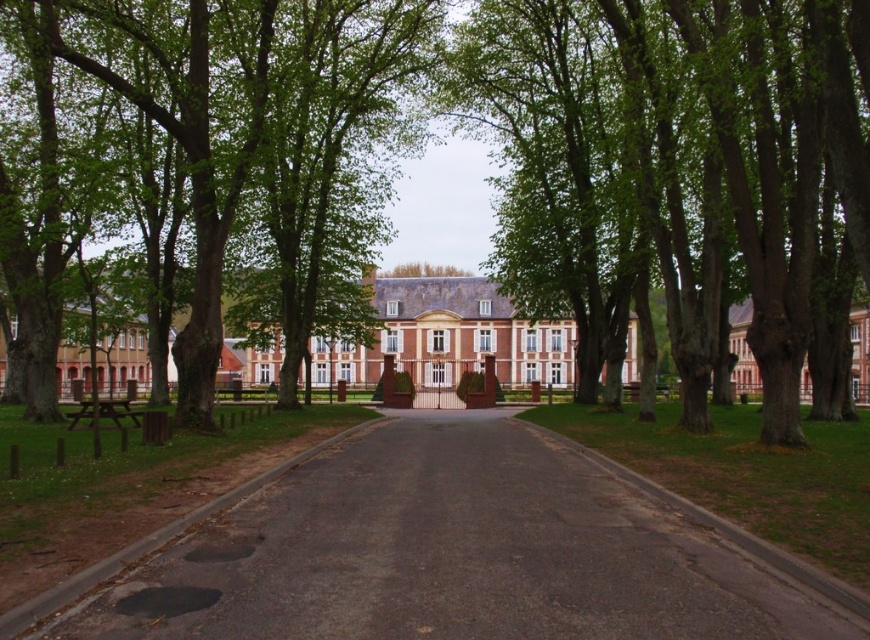
You are standing on the black asphalt road at center and want to reach the picnic table located on the left side of the road. Which direction should you walk to avoid the green leafy tree at center?

The black asphalt road at center is below the green leafy tree at center, so to avoid the tree, you should walk to the left side of the road towards the picnic table.

You are a visitor approaching the brick building at center and see the smooth bark tree at center. From your perspective, which object is on the right side?

The smooth bark tree at center is positioned on the right side of brick building at center.